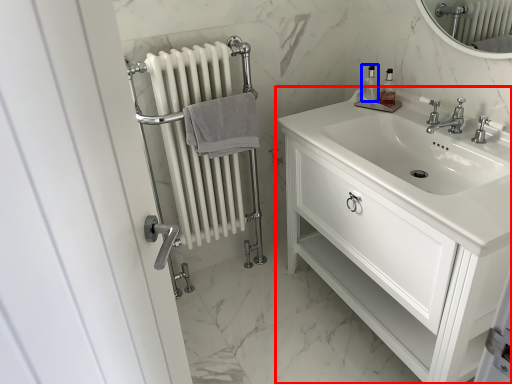
Question: Which point is closer to the camera, bathroom cabinet (highlighted by a red box) or soap dispenser (highlighted by a blue box)?

Choices:
 (A) bathroom cabinet
 (B) soap dispenser

Answer: (A)